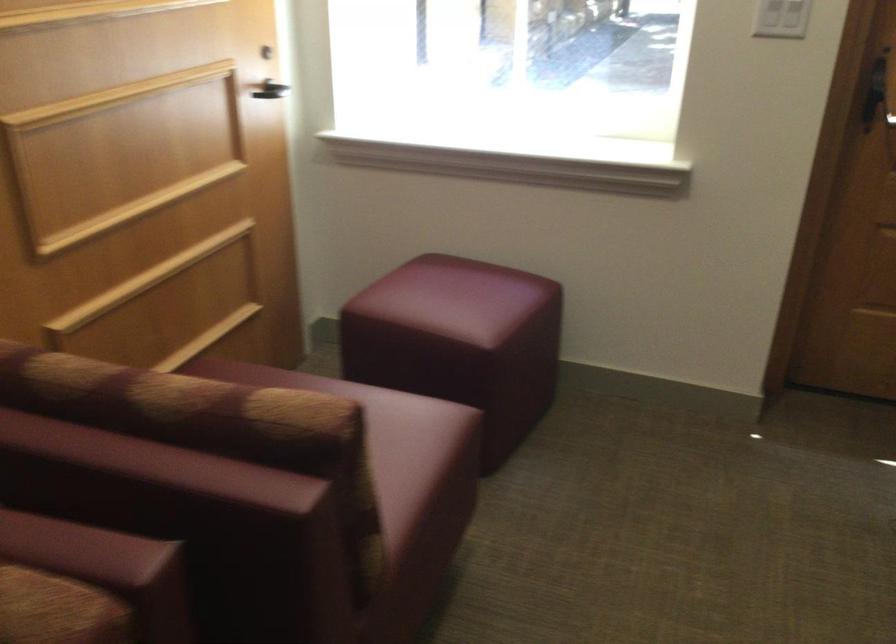
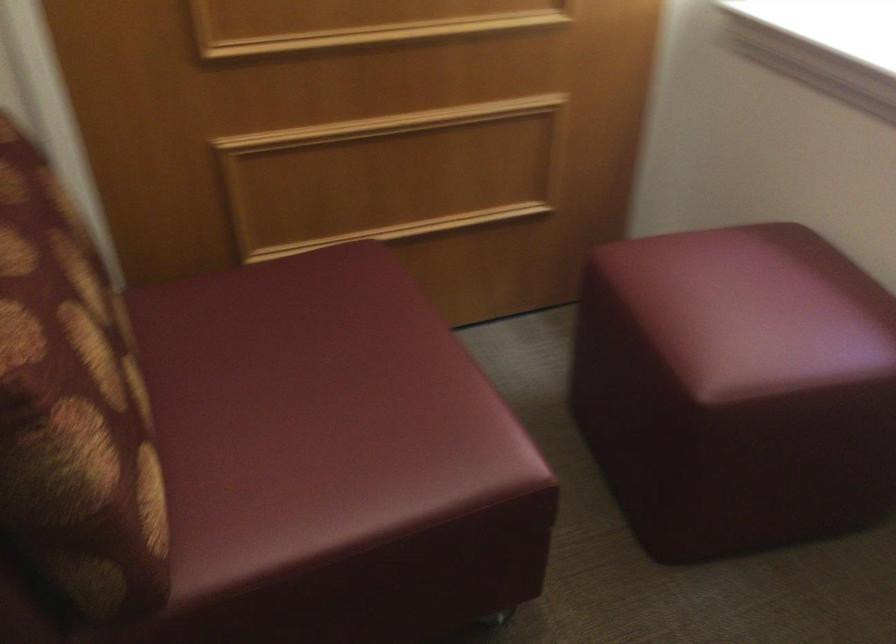
First-person continuous shooting, in which direction is the camera rotating?

The camera's rotation is toward left-down.